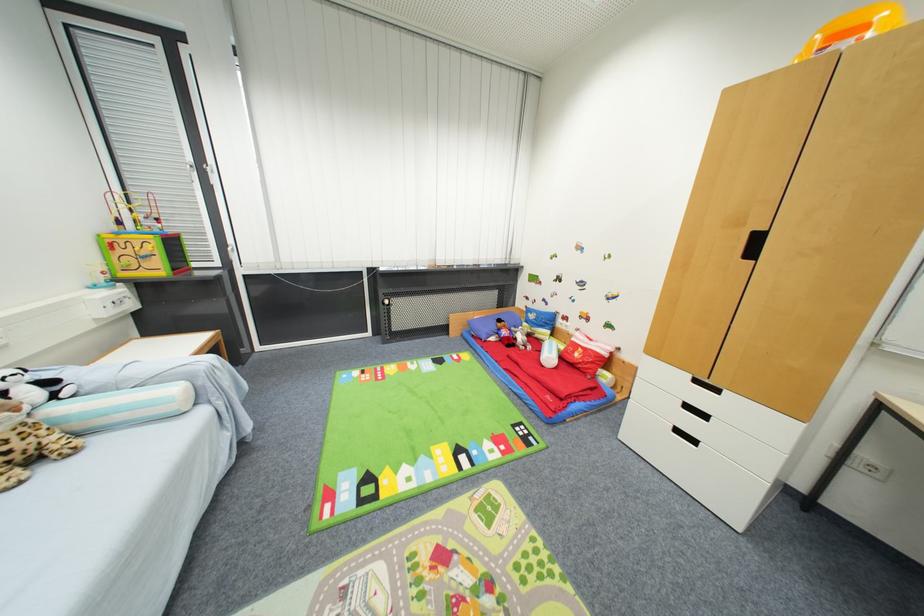
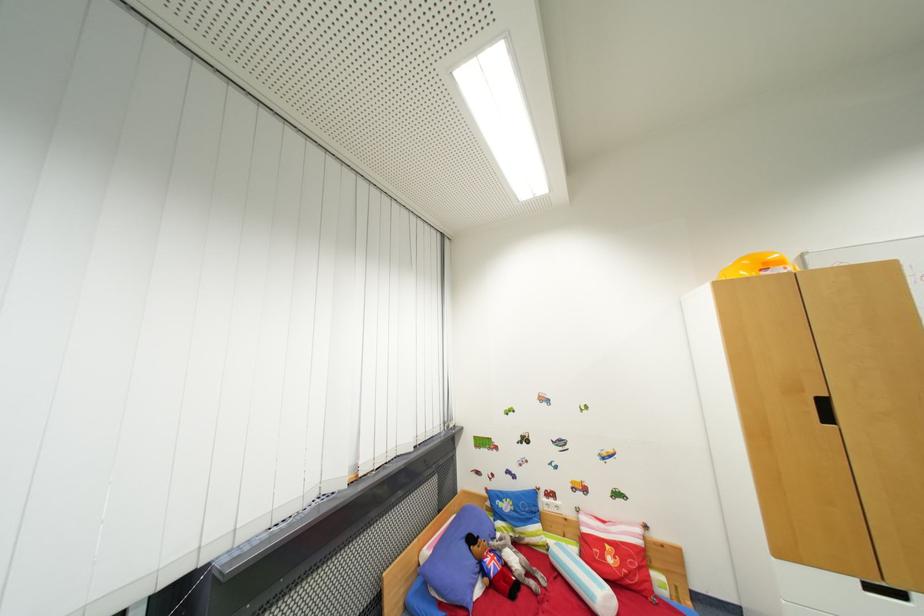
Where in the second image is the point corresponding to the point at 581,357 from the first image?

(614, 562)